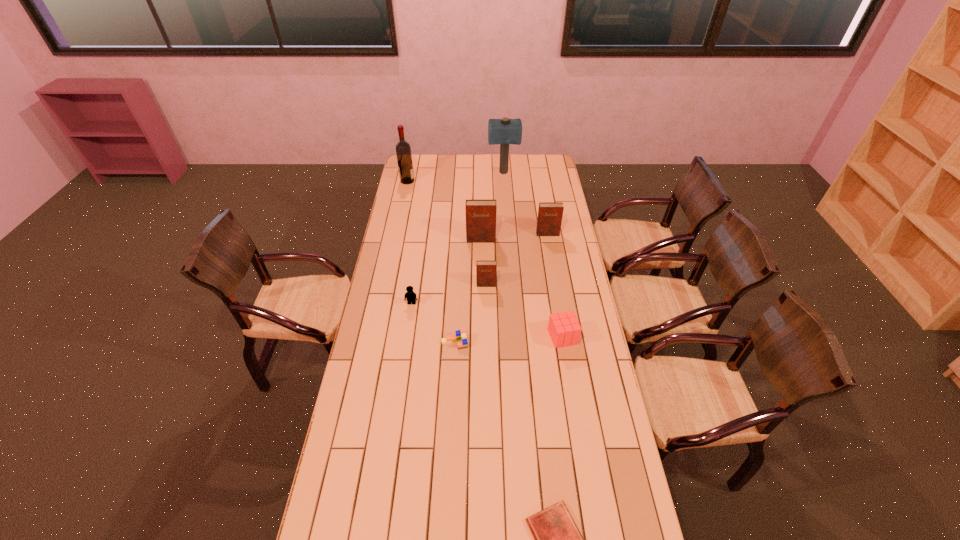
The image size is (960, 540). I want to click on the farther Lego, so click(410, 296).

Where is `yellow Lego`? This screenshot has width=960, height=540. yellow Lego is located at coordinates (410, 296).

Find the location of a particular element. The height and width of the screenshot is (540, 960). the shorter Lego is located at coordinates (460, 335).

The width and height of the screenshot is (960, 540). Find the location of `the nearer Lego`. the nearer Lego is located at coordinates click(x=460, y=335).

I want to click on free location located on the left of the brown mallet, so click(x=431, y=173).

Identify the location of free space located on the front and back of the green alcohol. The image size is (960, 540). (483, 181).

I want to click on free region located on the front cover of the second farthest diary, so click(481, 255).

Where is `vacant space located 0.280m on the front cover of the sixth shortest object`? This screenshot has height=540, width=960. vacant space located 0.280m on the front cover of the sixth shortest object is located at coordinates (555, 275).

Image resolution: width=960 pixels, height=540 pixels. Find the location of `free space located 0.320m on the front cover of the nearest reddish-brown diary`. free space located 0.320m on the front cover of the nearest reddish-brown diary is located at coordinates click(x=487, y=345).

Locate an element on the screen. This screenshot has height=540, width=960. vacant space situated 0.190m on the back of the cube is located at coordinates (555, 292).